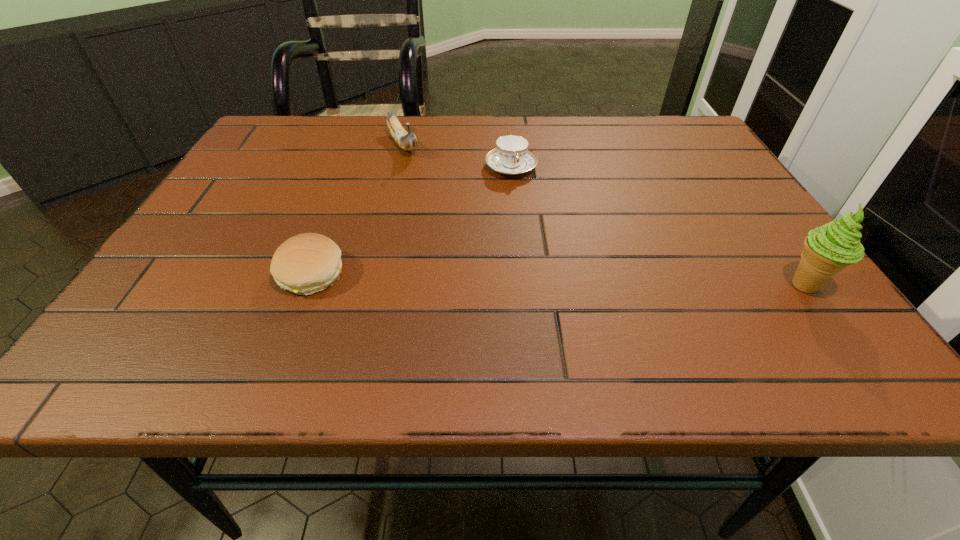
Where is `free point located at the stem of the second object from left to right`? free point located at the stem of the second object from left to right is located at coordinates (455, 228).

Identify the location of vacant space situated 0.160m on the side with the handle of the third object from left to right. (537, 224).

Where is `vacant region located 0.360m on the side with the handle of the third object from left to right`? vacant region located 0.360m on the side with the handle of the third object from left to right is located at coordinates coord(568,293).

Where is `vacant space situated 0.130m on the side with the handle of the third object from left to right`? Image resolution: width=960 pixels, height=540 pixels. vacant space situated 0.130m on the side with the handle of the third object from left to right is located at coordinates (533, 215).

This screenshot has width=960, height=540. Identify the location of banana located in the far edge section of the desktop. (406, 140).

This screenshot has width=960, height=540. Find the location of `teacup that is at the far edge`. teacup that is at the far edge is located at coordinates (511, 156).

Where is `patty that is at the near edge`? patty that is at the near edge is located at coordinates pyautogui.click(x=304, y=264).

This screenshot has height=540, width=960. Find the location of `icecream that is at the near edge`. icecream that is at the near edge is located at coordinates (829, 249).

Find the location of a particular element. This screenshot has width=960, height=540. object positioned at the right edge is located at coordinates (829, 249).

Where is `object situated at the near right corner`? The image size is (960, 540). object situated at the near right corner is located at coordinates (829, 249).